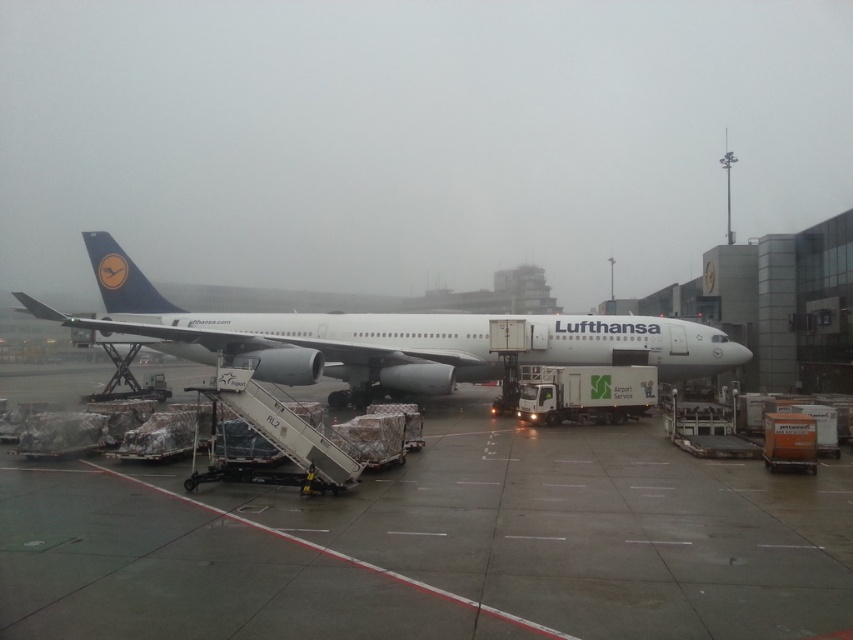
You are a maintenance worker needing to inspect the undercarriage of the white metallic airplane at center. Given that the concrete tarmac at center is below it, can you safely perform the inspection without needing a ladder?

Yes, the concrete tarmac at center is below the white metallic airplane at center, providing direct ground access, so you can safely inspect the undercarriage without a ladder.

You are a pilot who needs to ensure there is enough space for the white metallic airplane at center to taxi away from the concrete tarmac at center. Based on the scene, can you determine if the airplane has enough space to maneuver?

The concrete tarmac at center is shorter than the white metallic airplane at center, so the airplane may not have enough space to taxi away safely. The pilot should check for alternative paths or consult ground control for assistance.

You are a ground crew member standing on the concrete tarmac at center. You need to move to the white metallic airplane at center to assist with the passengers. Which direction should you walk to reach the airplane?

You should walk to the left because the concrete tarmac at center is to the right of the white metallic airplane at center, so moving left will bring you towards the airplane.